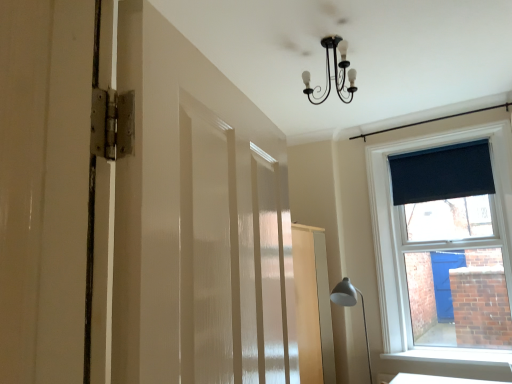
What is the approximate width of white textured barn door at left?

It is 6.11 inches.

This screenshot has width=512, height=384. Identify the location of dark blue fabric at upper right. (442, 173).

Measure the distance between point (479, 382) and camera.

Point (479, 382) and camera are 10.81 feet apart from each other.

Describe the element at coordinates (351, 306) in the screenshot. I see `matte silver lamp at lower right` at that location.

Describe the element at coordinates (334, 72) in the screenshot. The image size is (512, 384). I see `black wrought iron chandelier at upper center` at that location.

You are a GUI agent. You are given a task and a screenshot of the screen. Output one action in this format:
    pyautogui.click(x=<x>, y=<y>)
    Task: Click on the white textured barn door at left
    The width and height of the screenshot is (512, 384).
    Given the screenshot: What is the action you would take?
    pyautogui.click(x=193, y=218)

Which point is more distant from viewer, (450, 383) or (468, 146)?

Point (468, 146)

Considering the relative sizes of white glossy table at lower right and dark blue fabric at upper right in the image provided, is white glossy table at lower right wider than dark blue fabric at upper right?

Yes.

Does white glossy table at lower right appear on the left side of dark blue fabric at upper right?

Yes, white glossy table at lower right is to the left of dark blue fabric at upper right.

Is point (428, 175) positioned in front of point (483, 351)?

No.

Based on the photo, who is smaller, dark blue fabric at upper right or white smooth window sill at lower right?

With smaller size is white smooth window sill at lower right.

Does dark blue fabric at upper right lie behind white smooth window sill at lower right?

Yes, dark blue fabric at upper right is further from the camera.

Which object is positioned more to the left, white glossy table at lower right or black wrought iron chandelier at upper center?

black wrought iron chandelier at upper center is more to the left.

Is white glossy table at lower right in contact with black wrought iron chandelier at upper center?

white glossy table at lower right and black wrought iron chandelier at upper center are not in contact.

Which of these two, white glossy table at lower right or black wrought iron chandelier at upper center, is wider?

With larger width is white glossy table at lower right.

Which is nearer, (344,52) or (457,172)?

The point (344,52) is closer.

Looking at this image, is black wrought iron chandelier at upper center oriented towards dark blue fabric at upper right?

No, black wrought iron chandelier at upper center is not facing towards dark blue fabric at upper right.

In the scene shown: Can you tell me how much black wrought iron chandelier at upper center and dark blue fabric at upper right differ in facing direction?

The facing directions of black wrought iron chandelier at upper center and dark blue fabric at upper right are 0.416 degrees apart.

Considering the relative sizes of black wrought iron chandelier at upper center and dark blue fabric at upper right in the image provided, is black wrought iron chandelier at upper center taller than dark blue fabric at upper right?

Incorrect, the height of black wrought iron chandelier at upper center is not larger of that of dark blue fabric at upper right.

Between dark blue fabric at upper right and black wrought iron chandelier at upper center, which one appears on the left side from the viewer's perspective?

Positioned to the left is black wrought iron chandelier at upper center.

From the picture: From their relative heights in the image, would you say dark blue fabric at upper right is taller or shorter than black wrought iron chandelier at upper center?

In the image, dark blue fabric at upper right appears to be taller than black wrought iron chandelier at upper center.

Consider the image. Does dark blue fabric at upper right have a larger size compared to black wrought iron chandelier at upper center?

→ No, dark blue fabric at upper right is not bigger than black wrought iron chandelier at upper center.

From the image's perspective, is dark blue fabric at upper right on top of black wrought iron chandelier at upper center?

Incorrect, from the image's perspective, dark blue fabric at upper right is lower than black wrought iron chandelier at upper center.

Identify the location of table lamp above the white glossy table at lower right (from a real-world perspective). (351, 306).

Considering the relative sizes of white glossy table at lower right and matte silver lamp at lower right in the image provided, is white glossy table at lower right taller than matte silver lamp at lower right?

Incorrect, the height of white glossy table at lower right is not larger of that of matte silver lamp at lower right.

Is white glossy table at lower right in contact with matte silver lamp at lower right?

No, white glossy table at lower right is not in contact with matte silver lamp at lower right.

Is white glossy table at lower right facing away from matte silver lamp at lower right?

No, matte silver lamp at lower right is not at the back of white glossy table at lower right.

Who is smaller, white textured barn door at left or dark blue fabric at upper right?

With smaller size is dark blue fabric at upper right.

From the image's perspective, is white textured barn door at left located above dark blue fabric at upper right?

No, from the image's perspective, white textured barn door at left is not over dark blue fabric at upper right.

Between white textured barn door at left and dark blue fabric at upper right, which one is positioned behind?

dark blue fabric at upper right is behind.

How many degrees apart are the facing directions of white textured barn door at left and dark blue fabric at upper right?

The angle between the facing direction of white textured barn door at left and the facing direction of dark blue fabric at upper right is 104 degrees.

Find the location of a particular element. Image resolution: width=512 pixels, height=384 pixels. table below the dark blue fabric at upper right (from the image's perspective) is located at coordinates (437, 380).

Identify the location of window sill located underneath the dark blue fabric at upper right (from a real-world perspective). (453, 356).

Looking at the image, which one is located closer to white glossy table at lower right, matte silver lamp at lower right or black wrought iron chandelier at upper center?

Among the two, matte silver lamp at lower right is located nearer to white glossy table at lower right.

Estimate the real-world distances between objects in this image. Which object is further from white textured barn door at left, dark blue fabric at upper right or matte silver lamp at lower right?

Among the two, dark blue fabric at upper right is located further to white textured barn door at left.

Looking at the image, which one is located further to matte silver lamp at lower right, white glossy table at lower right or white smooth window sill at lower right?

The object further to matte silver lamp at lower right is white smooth window sill at lower right.

Which object lies further to the anchor point matte silver lamp at lower right, white glossy table at lower right or white textured barn door at left?

The object further to matte silver lamp at lower right is white textured barn door at left.

Considering their positions, is matte silver lamp at lower right positioned closer to black wrought iron chandelier at upper center than white smooth window sill at lower right?

matte silver lamp at lower right is closer to black wrought iron chandelier at upper center.

From the picture: Considering their positions, is white smooth window sill at lower right positioned closer to white textured barn door at left than black wrought iron chandelier at upper center?

The object closer to white textured barn door at left is black wrought iron chandelier at upper center.

From the image, which object appears to be nearer to dark blue fabric at upper right, white smooth window sill at lower right or matte silver lamp at lower right?

matte silver lamp at lower right lies closer to dark blue fabric at upper right than the other object.

Considering their positions, is white glossy table at lower right positioned closer to white smooth window sill at lower right than black wrought iron chandelier at upper center?

white glossy table at lower right is closer to white smooth window sill at lower right.

The height and width of the screenshot is (384, 512). Find the location of `curtain that lies between black wrought iron chandelier at upper center and white glossy table at lower right from top to bottom`. curtain that lies between black wrought iron chandelier at upper center and white glossy table at lower right from top to bottom is located at coordinates (442, 173).

The image size is (512, 384). Find the location of `window sill between black wrought iron chandelier at upper center and white glossy table at lower right vertically`. window sill between black wrought iron chandelier at upper center and white glossy table at lower right vertically is located at coordinates (453, 356).

Image resolution: width=512 pixels, height=384 pixels. I want to click on table between white textured barn door at left and dark blue fabric at upper right in the front-back direction, so click(437, 380).

I want to click on table between matte silver lamp at lower right and white smooth window sill at lower right, so click(437, 380).